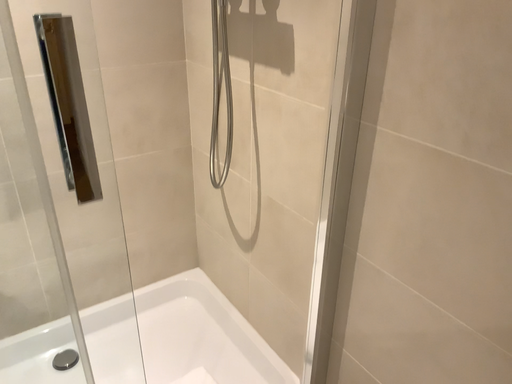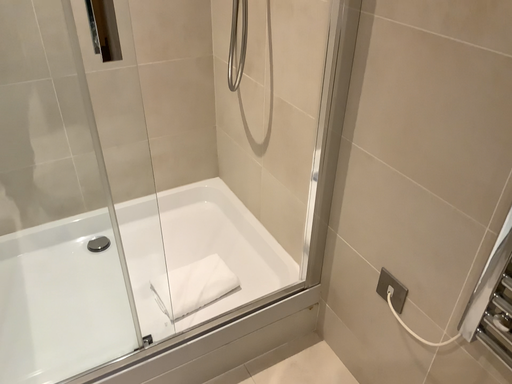
Question: How did the camera likely rotate when shooting the video?

Choices:
 (A) rotated upward
 (B) rotated downward

Answer: (B)